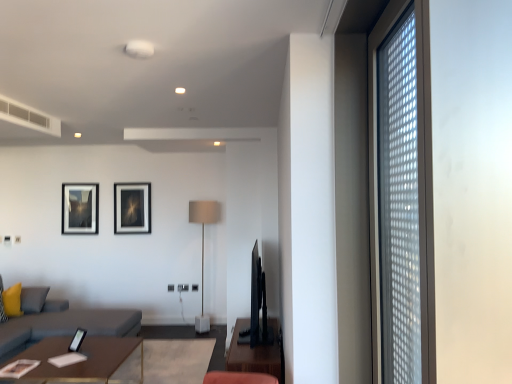
This screenshot has height=384, width=512. I want to click on free spot behind matte black picture frame at lower center, the 3th picture frame from the top, so click(82, 340).